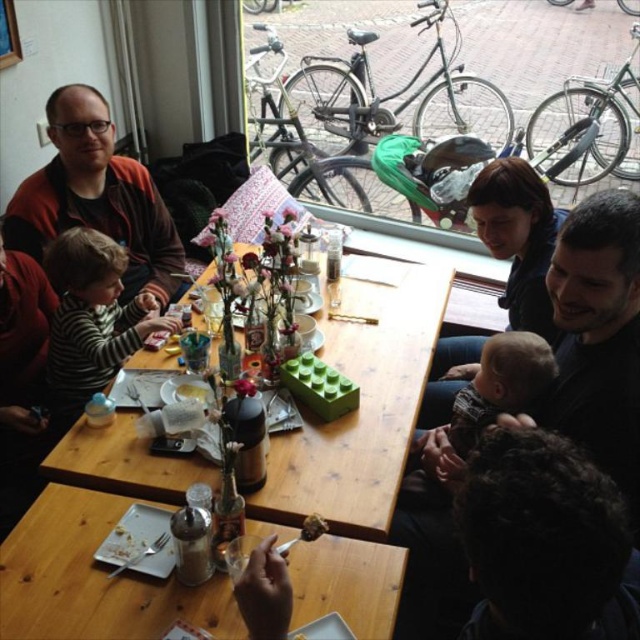
Based on the photo, is wooden table at center to the left of matte red sweater at upper left from the viewer's perspective?

No, wooden table at center is not to the left of matte red sweater at upper left.

Which of these two, wooden table at center or matte red sweater at upper left, stands taller?

matte red sweater at upper left is taller.

The image size is (640, 640). What are the coordinates of `wooden table at center` in the screenshot? It's located at (362, 410).

Does wooden table at lower center appear under soft beige baby at center?

Correct, wooden table at lower center is located below soft beige baby at center.

Locate an element on the screen. Image resolution: width=640 pixels, height=640 pixels. wooden table at lower center is located at coordinates (93, 579).

Who is more distant from viewer, (349, 374) or (292, 556)?

Point (349, 374)

How much distance is there between wooden table at center and wooden table at lower center?

They are 13.84 inches apart.

Is point (429, 323) in front of point (368, 604)?

No.

Image resolution: width=640 pixels, height=640 pixels. I want to click on wooden table at center, so click(x=362, y=410).